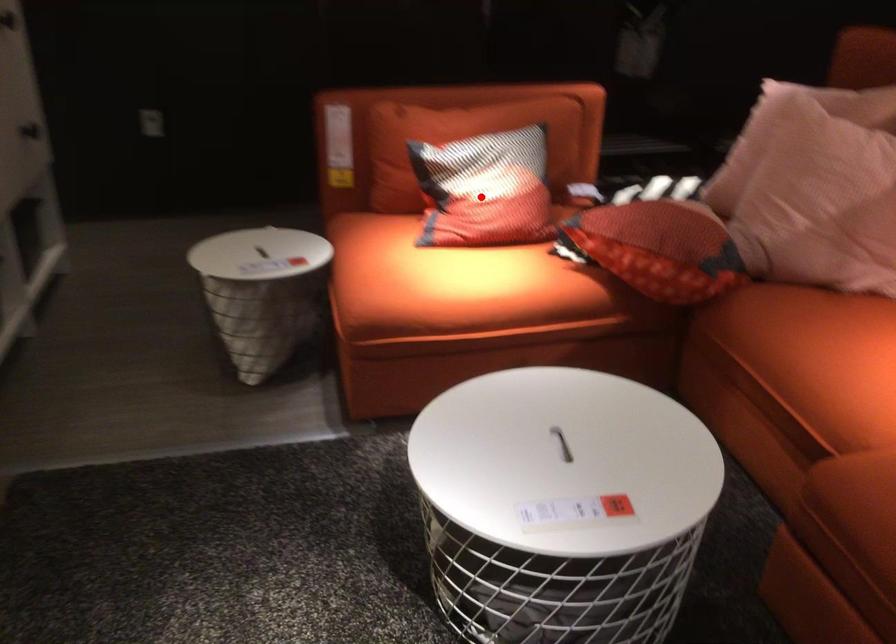
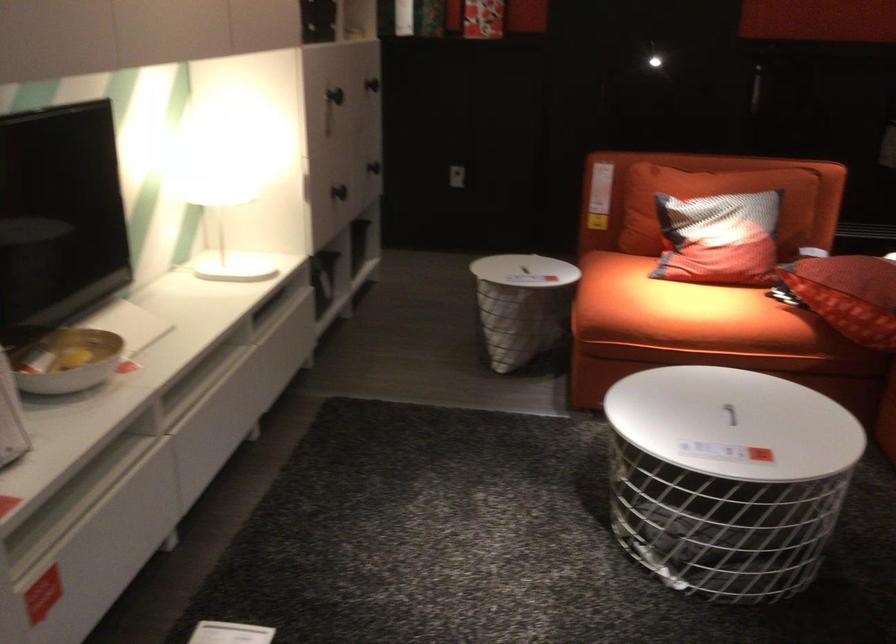
The point at the highlighted location is marked in the first image. Where is the corresponding point in the second image?

(719, 239)